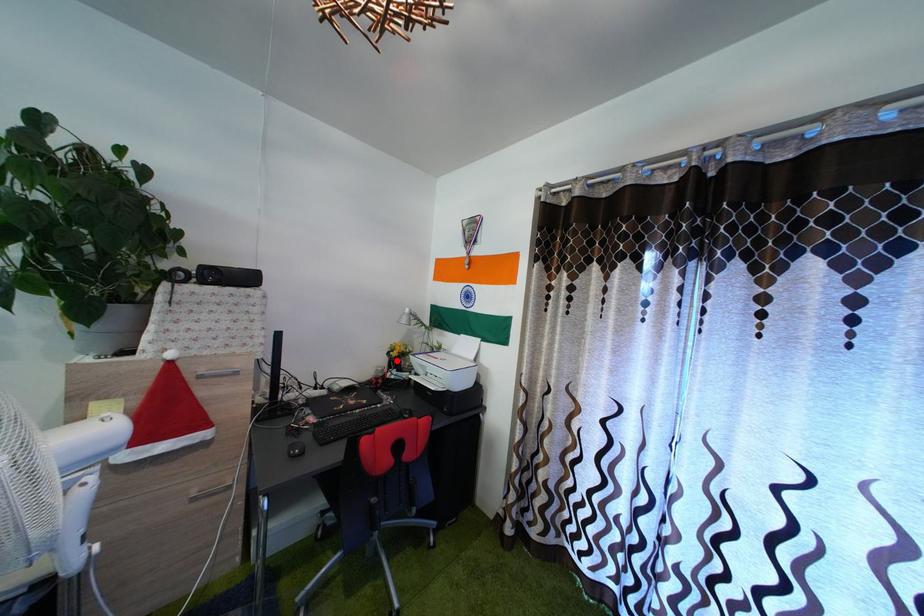
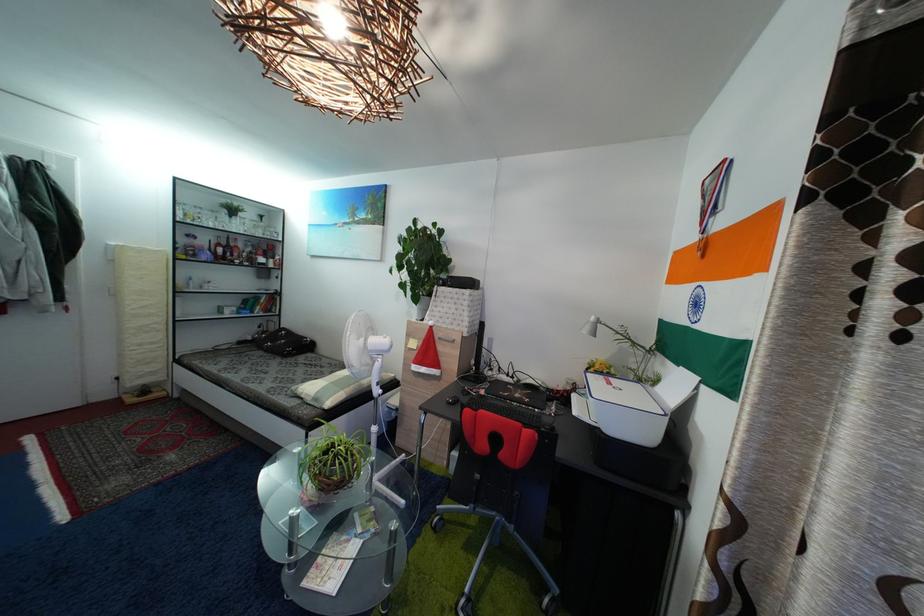
Locate, in the second image, the point that corresponds to the highlighted location in the first image.

(596, 377)